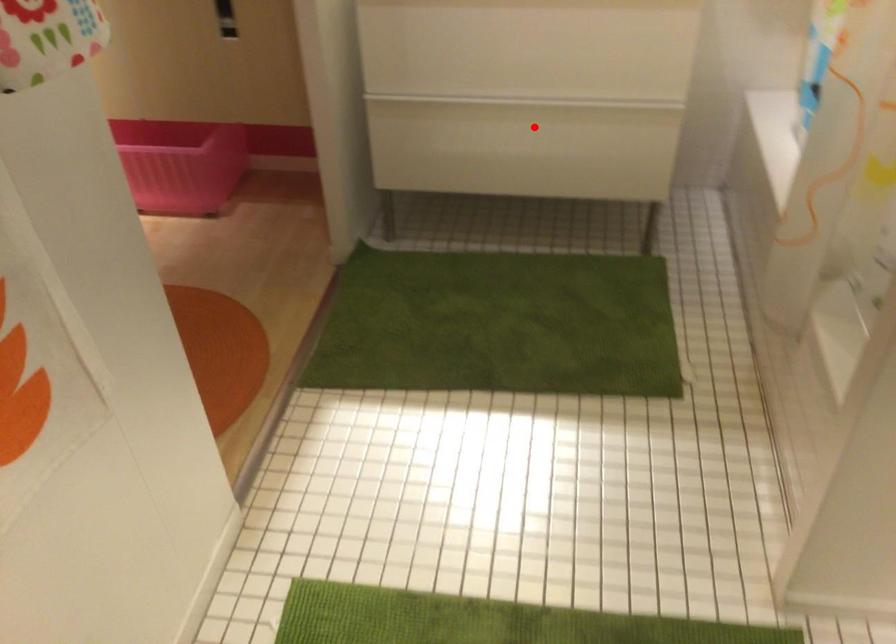
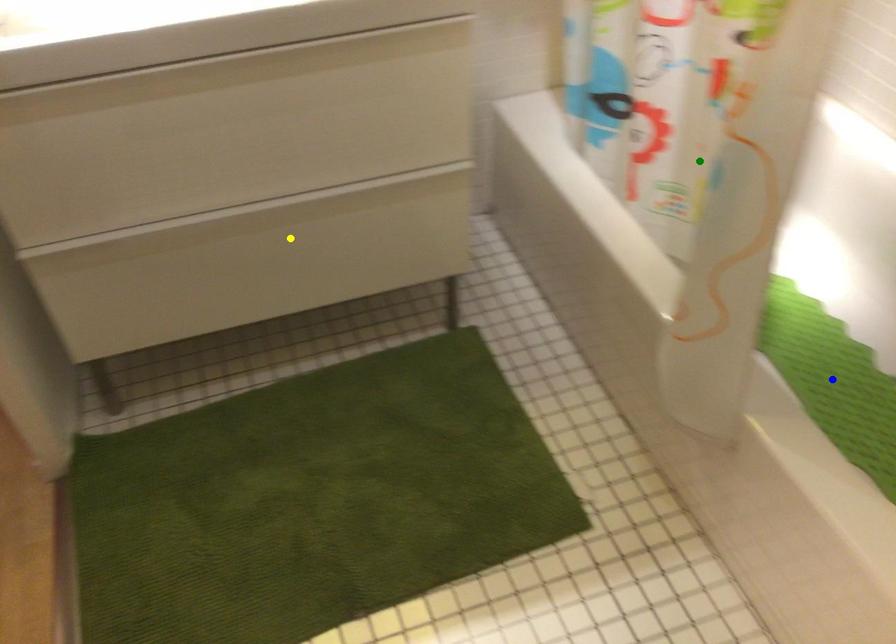
Question: I am providing you with two images of the same scene from different viewpoints. A red point is marked on the first image. You are given multiple points on the second image. Which point in image 2 is actually the same real-world point as the red point in image 1?

Choices:
 (A) blue point
 (B) green point
 (C) yellow point

Answer: (C)